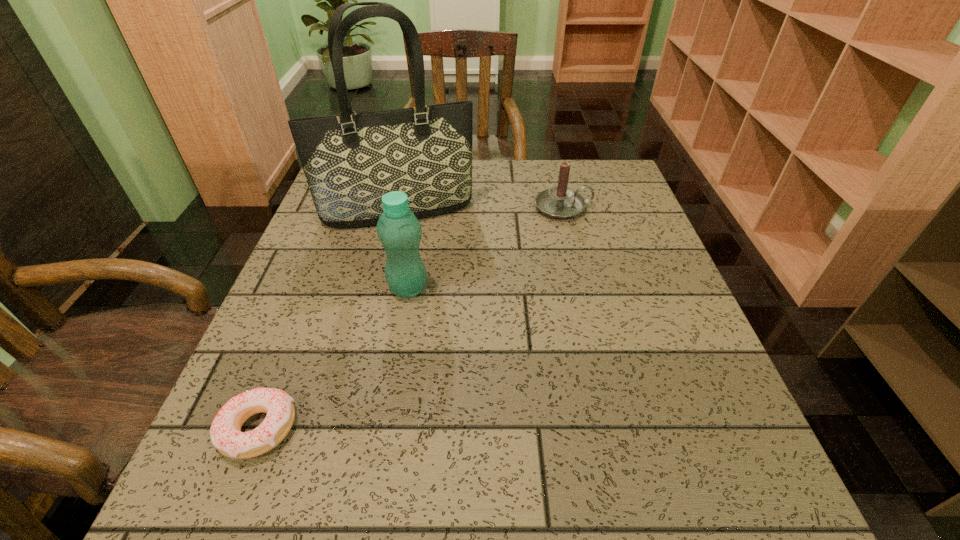
In the image, there is a desktop. Where is `free space at the far edge`? This screenshot has width=960, height=540. free space at the far edge is located at coordinates (529, 176).

This screenshot has height=540, width=960. What are the coordinates of `free space at the near edge` in the screenshot? It's located at (533, 497).

In the image, there is a desktop. At what (x,y) coordinates should I click in order to perform the action: click on vacant space at the left edge. Please return your answer as a coordinate pair (x, y). Image resolution: width=960 pixels, height=540 pixels. Looking at the image, I should click on (332, 240).

In the image, there is a desktop. Identify the location of vacant area at the right edge. The image size is (960, 540). (611, 229).

Where is `vacant space at the far right corner`? vacant space at the far right corner is located at coordinates (630, 205).

Identify the location of free space between the nearest object and the tote bag. (328, 321).

Where is `free area in between the candle and the tallest object`? The width and height of the screenshot is (960, 540). free area in between the candle and the tallest object is located at coordinates (481, 210).

I want to click on free space between the third shortest object and the shortest object, so click(x=333, y=359).

Find the location of `vacant space in between the shortest object and the tallest object`. vacant space in between the shortest object and the tallest object is located at coordinates (328, 321).

Identify the location of vacant space that's between the doughnut and the second nearest object. (333, 359).